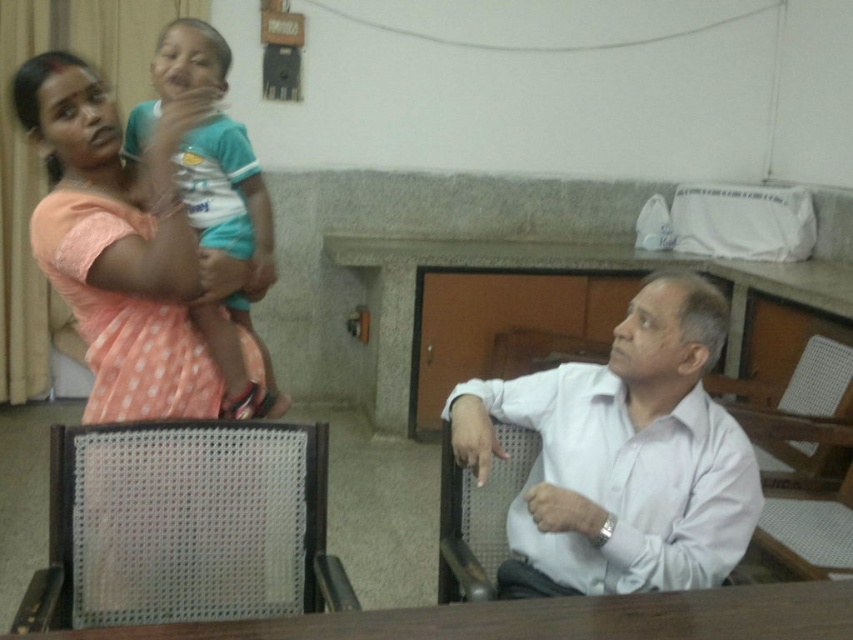
Question: Which of the following is the closest to the observer?

Choices:
 (A) (538, 611)
 (B) (158, 113)
 (C) (186, 385)
 (D) (689, 339)

Answer: (A)

Question: In this image, where is white shirt at center located relative to metal mesh chair at lower left?

Choices:
 (A) left
 (B) right

Answer: (B)

Question: Does white shirt at center come in front of metal mesh chair at right?

Choices:
 (A) no
 (B) yes

Answer: (B)

Question: Which point is closer to the camera taking this photo?

Choices:
 (A) (590, 632)
 (B) (575, 592)

Answer: (A)

Question: Can you confirm if white shirt at center is bigger than brown wooden table at lower center?

Choices:
 (A) yes
 (B) no

Answer: (A)

Question: Which point is closer to the camera taking this photo?

Choices:
 (A) (669, 298)
 (B) (619, 596)
 (C) (836, 413)

Answer: (B)